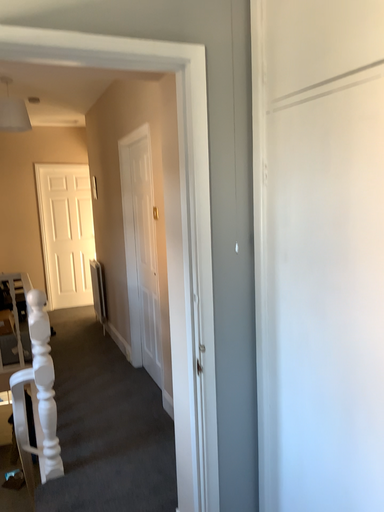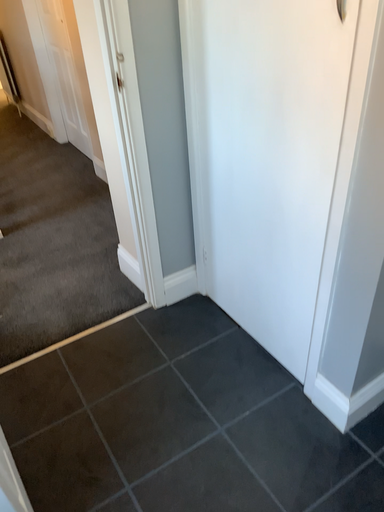
Question: How did the camera likely rotate when shooting the video?

Choices:
 (A) rotated right
 (B) rotated left

Answer: (A)